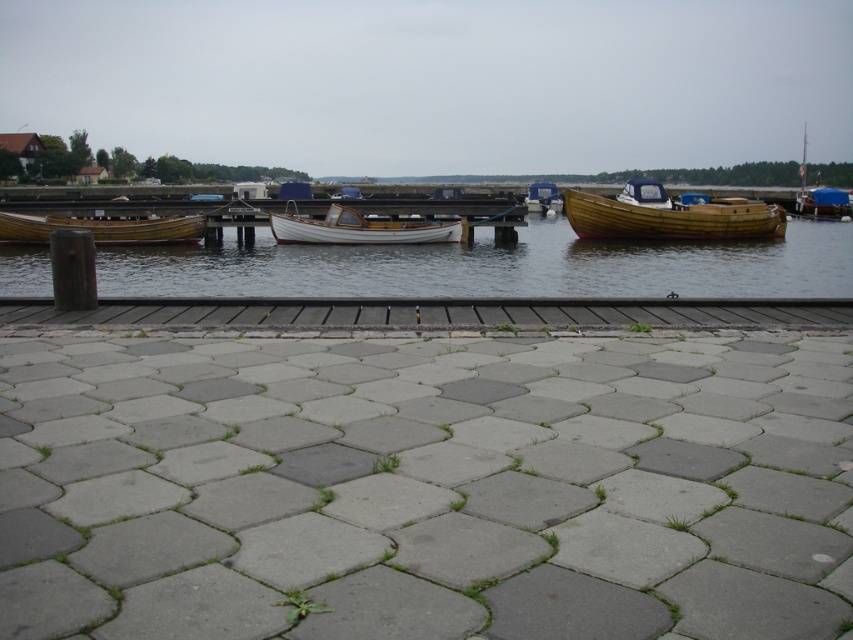
Is wooden boat at center bigger than wooden boat at right?

Indeed, wooden boat at center has a larger size compared to wooden boat at right.

Who is higher up, wooden boat at center or wooden boat at right?

Positioned higher is wooden boat at right.

You are a GUI agent. You are given a task and a screenshot of the screen. Output one action in this format:
    pyautogui.click(x=<x>, y=<y>)
    Task: Click on the wooden boat at center
    The width and height of the screenshot is (853, 640).
    Given the screenshot: What is the action you would take?
    pyautogui.click(x=669, y=216)

The height and width of the screenshot is (640, 853). Find the location of `wooden boat at center`. wooden boat at center is located at coordinates (669, 216).

Does wooden boats at center appear on the left side of wooden boat at left?

Incorrect, wooden boats at center is not on the left side of wooden boat at left.

The height and width of the screenshot is (640, 853). In order to click on wooden boats at center in this screenshot , I will do pos(492,266).

This screenshot has height=640, width=853. Identify the location of wooden boats at center. (492, 266).

Which is in front, point (165, 228) or point (529, 208)?

Point (165, 228) is more forward.

Between wooden boat at left and matte blue boat at center, which one is positioned higher?

Positioned higher is matte blue boat at center.

Measure the distance between wooden boat at left and camera.

wooden boat at left is 23.60 meters away from camera.

Image resolution: width=853 pixels, height=640 pixels. I want to click on wooden boat at left, so click(x=103, y=228).